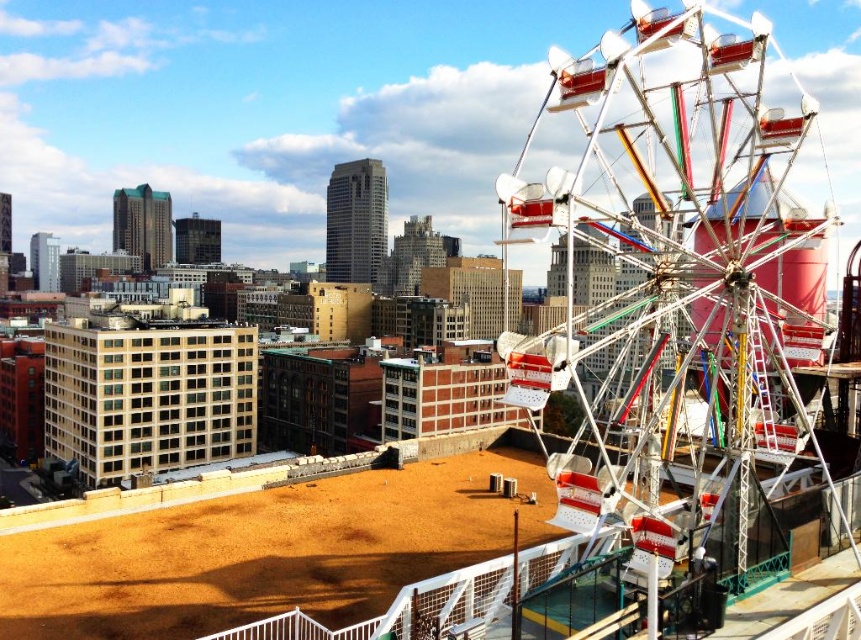
Who is positioned more to the left, metallic ferris wheel at right or brown sandy dirt field at lower center?

Positioned to the left is brown sandy dirt field at lower center.

From the picture: Who is taller, metallic ferris wheel at right or brown sandy dirt field at lower center?

With more height is metallic ferris wheel at right.

Between point (570, 90) and point (184, 509), which one is positioned in front?

Positioned in front is point (570, 90).

Locate an element on the screen. metallic ferris wheel at right is located at coordinates (678, 282).